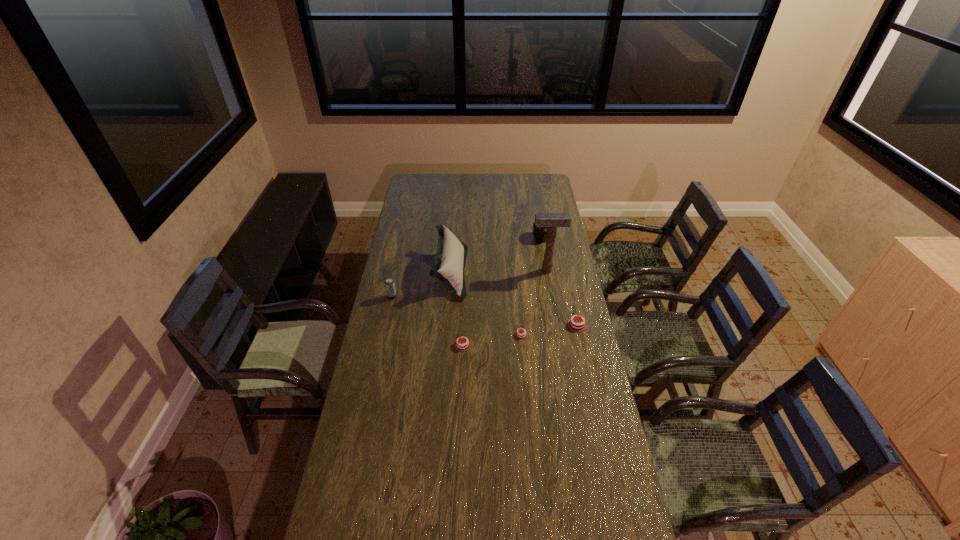
What are the coordinates of `vacant place for an extra chocolate cake on the left` in the screenshot? It's located at (401, 356).